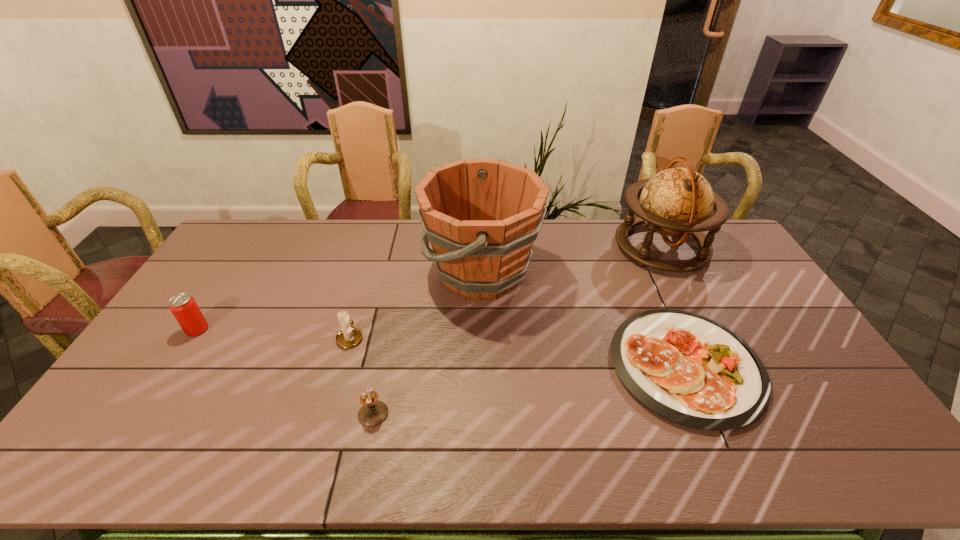
Identify the location of the second closest object relative to the shortest object. (676, 202).

This screenshot has height=540, width=960. What are the coordinates of `free space that satisfies the following two spatial constraints: 1. on the back side of the leftmost object; 2. on the right side of the globe` in the screenshot? It's located at (251, 247).

Locate an element on the screen. free spot that satisfies the following two spatial constraints: 1. on the handle side of the dish; 2. on the left side of the third object from right to left is located at coordinates (482, 366).

Locate an element on the screen. The height and width of the screenshot is (540, 960). free location that satisfies the following two spatial constraints: 1. on the handle side of the dish; 2. on the left side of the bucket is located at coordinates (482, 366).